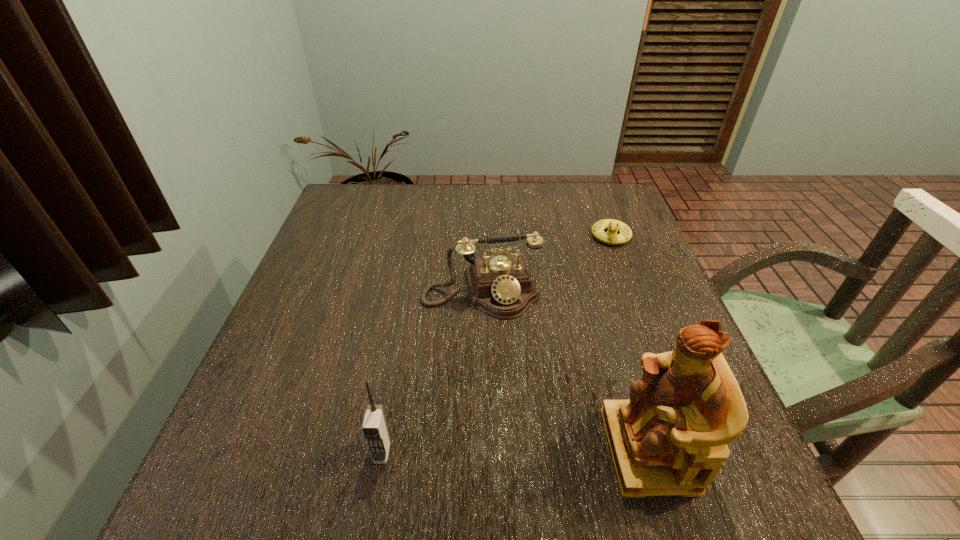
Where is `vacant space on the desktop that is between the leftmost object and the figurine and is positioned on the face of the duckling`? The height and width of the screenshot is (540, 960). vacant space on the desktop that is between the leftmost object and the figurine and is positioned on the face of the duckling is located at coordinates (550, 450).

Image resolution: width=960 pixels, height=540 pixels. I want to click on free spot on the desktop that is between the cellular telephone and the figurine and is positioned on the dial of the telephone, so 520,451.